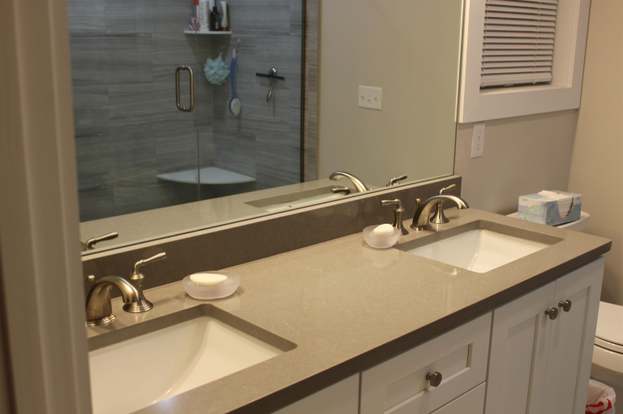
The width and height of the screenshot is (623, 414). Identify the location of counter. (358, 301).